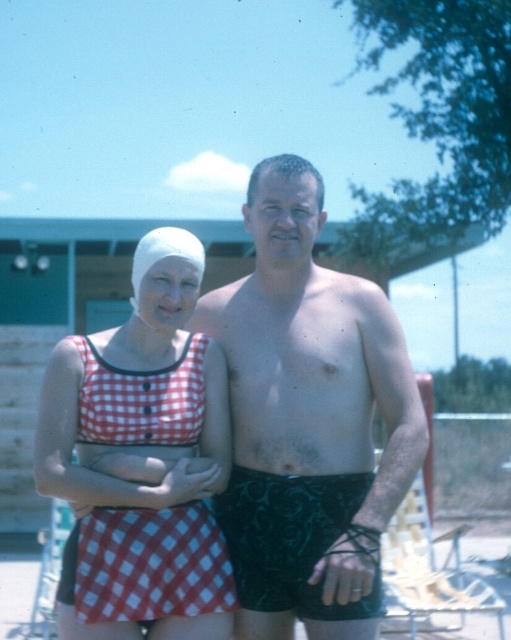
You are at a poolside and see the red checkered fabric at lower left and the white matte swim cap at upper left. Which object is positioned more to the east if the sun is setting in the west?

The red checkered fabric at lower left is to the right of the white matte swim cap at upper left. Since the sun is setting in the west, the right side of the image would correspond to the east. Therefore, the red checkered fabric at lower left is positioned more to the east.

You are a photographer at the poolside and need to capture a closeup shot of the red checkered fabric at lower left and the white matte swim cap at upper left. Since your camera can only focus on one object at a time, which object should you choose to ensure it fills more of the frame?

The white matte swim cap at upper left occupies more space than the red checkered fabric at lower left, so you should choose the white matte swim cap at upper left to fill the frame more.

You are designing a new swimsuit collection and want to ensure that the swim cap fits under the swimsuit collar. Given the red checkered swimsuit at center and the white matte swim cap at upper left, which one has a wider width that could accommodate the cap?

The red checkered swimsuit at center has a larger width than the white matte swim cap at upper left, so it can accommodate the cap.